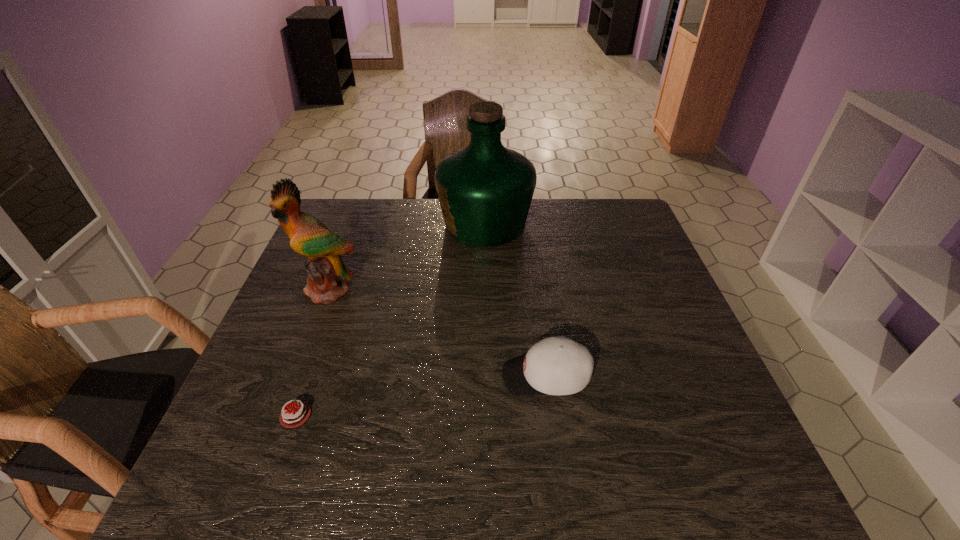
This screenshot has height=540, width=960. What are the coordinates of `vacant space that's between the second shortest object and the parrot` in the screenshot? It's located at (437, 333).

You are a GUI agent. You are given a task and a screenshot of the screen. Output one action in this format:
    pyautogui.click(x=<x>, y=<y>)
    Task: Click on the blank region between the farthest object and the third nearest object
    This screenshot has height=540, width=960.
    Given the screenshot: What is the action you would take?
    pyautogui.click(x=407, y=257)

Locate an element on the screen. Image resolution: width=960 pixels, height=540 pixels. the second closest object to the third nearest object is located at coordinates (294, 416).

Point out which object is positioned as the second nearest to the liquor. Please provide its 2D coordinates. Your answer should be formatted as a tuple, i.e. [(x, y)], where the tuple contains the x and y coordinates of a point satisfying the conditions above.

[(557, 365)]

Where is `vacant area in the image that satisfies the following two spatial constraints: 1. on the label side of the liquor; 2. on the front side of the chocolate cake`? Image resolution: width=960 pixels, height=540 pixels. vacant area in the image that satisfies the following two spatial constraints: 1. on the label side of the liquor; 2. on the front side of the chocolate cake is located at coordinates (488, 415).

Where is `free space that satisfies the following two spatial constraints: 1. on the label side of the farthest object; 2. on the front-facing side of the parrot`? free space that satisfies the following two spatial constraints: 1. on the label side of the farthest object; 2. on the front-facing side of the parrot is located at coordinates (486, 290).

Find the location of `blank area in the image that satisfies the following two spatial constraints: 1. on the label side of the farthest object; 2. on the front-facing side of the parrot`. blank area in the image that satisfies the following two spatial constraints: 1. on the label side of the farthest object; 2. on the front-facing side of the parrot is located at coordinates (486, 290).

Identify the location of vacant area that satisfies the following two spatial constraints: 1. on the label side of the liquor; 2. on the front-facing side of the parrot. (486, 290).

This screenshot has height=540, width=960. In order to click on vacant space that satisfies the following two spatial constraints: 1. on the front-facing side of the second shortest object; 2. on the front side of the shortest object in this screenshot , I will do `click(551, 415)`.

Where is `free space that satisfies the following two spatial constraints: 1. on the front-facing side of the shortest object; 2. on the right side of the parrot`? The image size is (960, 540). free space that satisfies the following two spatial constraints: 1. on the front-facing side of the shortest object; 2. on the right side of the parrot is located at coordinates (280, 415).